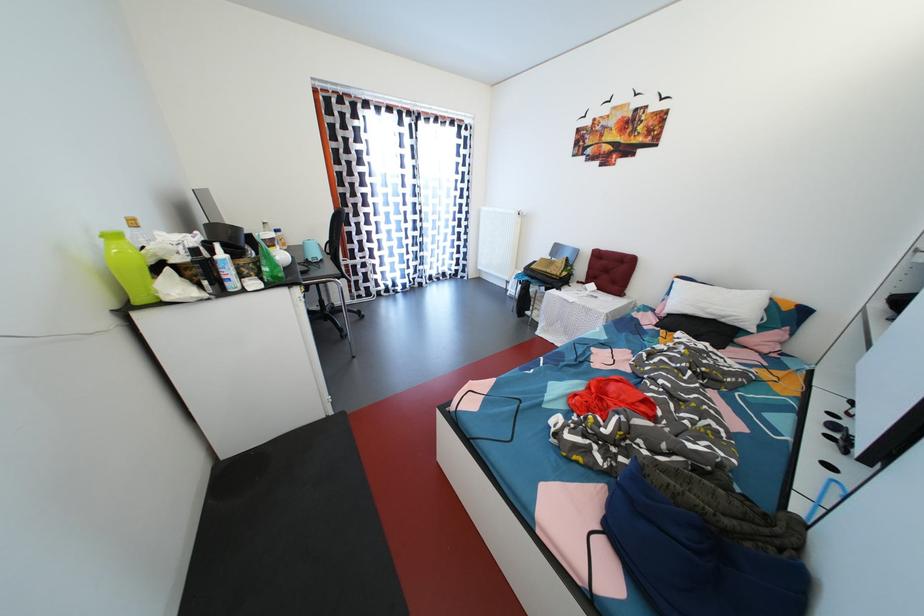
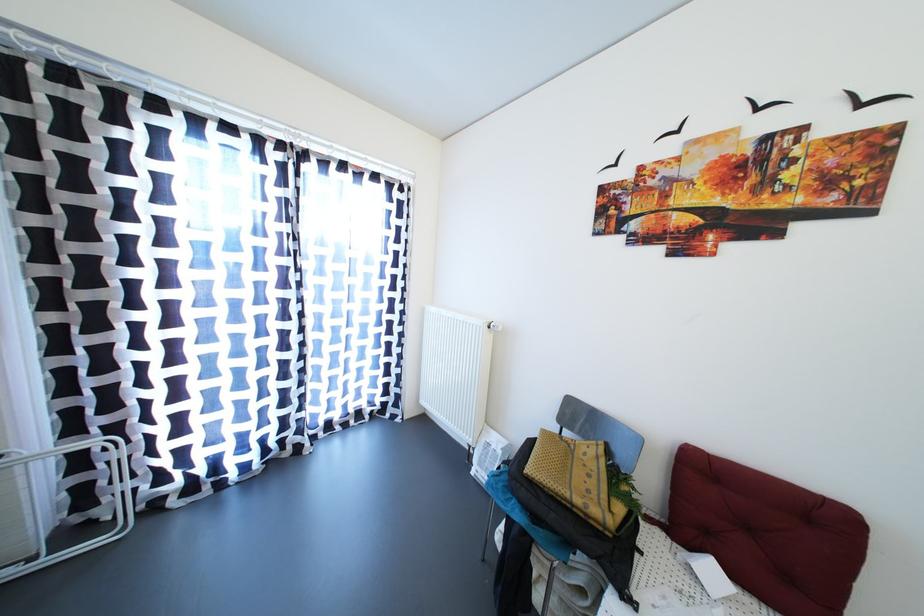
Where in the second image is the point corresponding to (x=485, y=273) from the first image?

(430, 407)